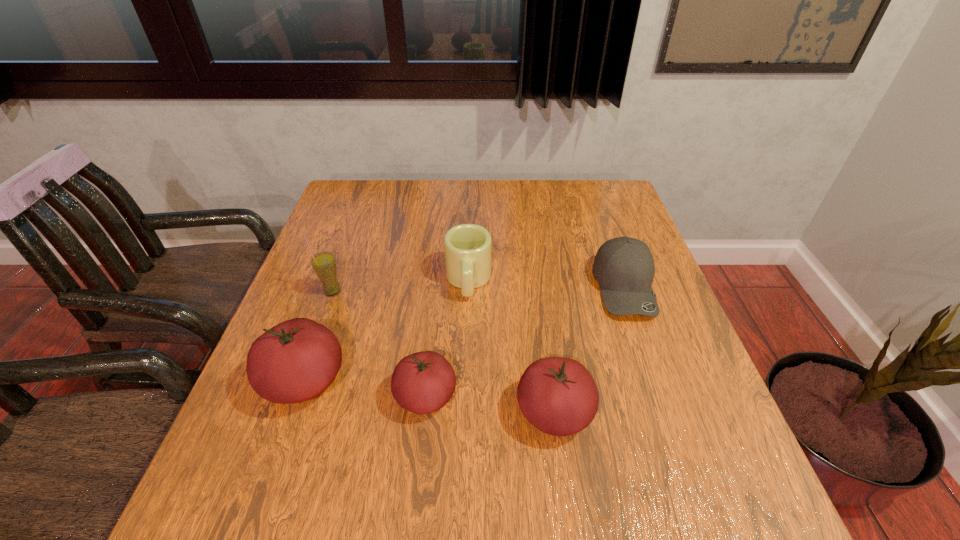
Find the location of `the leftmost tomato`. the leftmost tomato is located at coordinates (296, 360).

I want to click on the second tomato from left to right, so click(423, 382).

In order to click on the second object from right to left in this screenshot , I will do `click(557, 395)`.

I want to click on the rightmost tomato, so pyautogui.click(x=557, y=395).

Image resolution: width=960 pixels, height=540 pixels. I want to click on the rightmost object, so click(x=624, y=267).

Where is `straw for drinking`? This screenshot has height=540, width=960. straw for drinking is located at coordinates (324, 264).

Identify the location of mug. This screenshot has height=540, width=960. (467, 247).

Identify the location of vacant space located 0.140m on the back of the leftmost tomato. (332, 302).

This screenshot has width=960, height=540. Find the location of `blank area located on the left of the second tomato from right to left`. blank area located on the left of the second tomato from right to left is located at coordinates (249, 396).

The image size is (960, 540). I want to click on free space located on the left of the second tallest tomato, so click(x=474, y=413).